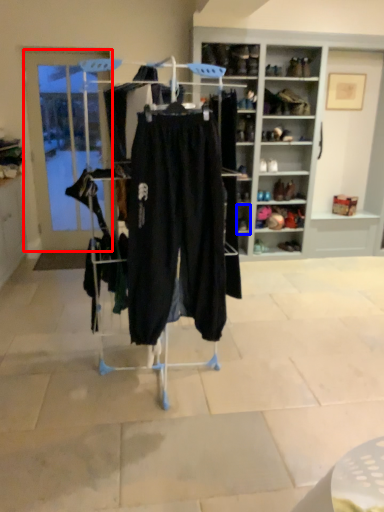
Question: Which of the following is the closest to the observer, door (highlighted by a red box) or shelf (highlighted by a blue box)?

Choices:
 (A) door
 (B) shelf

Answer: (A)